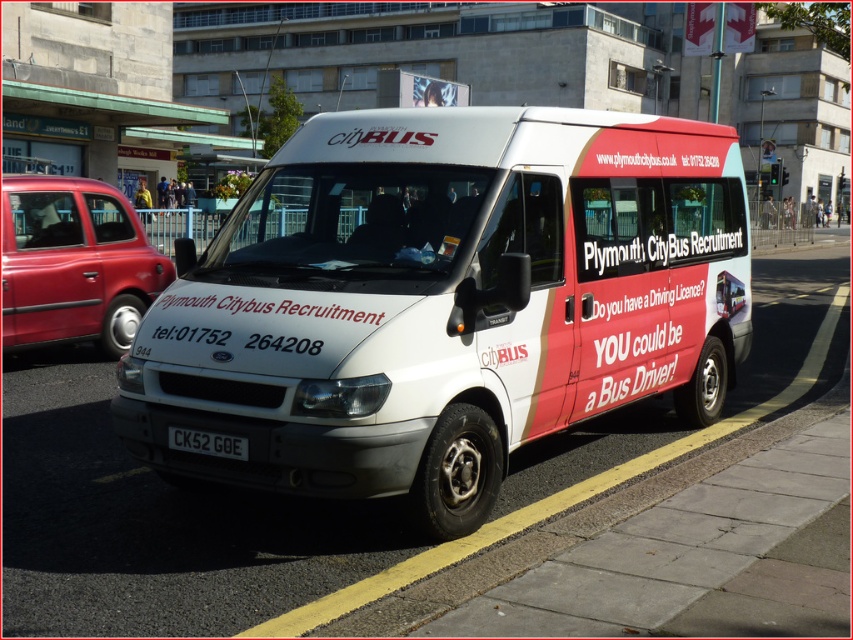
You are a delivery driver who needs to park your truck next to the white matte van at center and the yellow painted curb at lower center. Which one should you park closer to if you want to avoid blocking the sidewalk?

You should park closer to the yellow painted curb at lower center because the white matte van at center is larger in size and might block the sidewalk more if parked too close.

You are standing at the point closest to the van. Which of the two points, point (790, 392) or point (183, 433), is farther away from you?

Point (790, 392) is farther away from you because it is behind point (183, 433).

You are a photographer trying to capture the black plastic license plate at center without the white matte van at center blocking it. Is this possible given their current positions?

The white matte van at center is positioned over the black plastic license plate at center, so it is not possible to capture the license plate without the van blocking it.